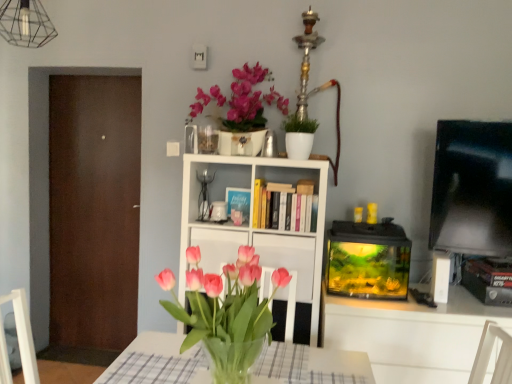
Question: Would you say white glossy mug at center is outside matte ceramic vase at upper center?

Choices:
 (A) yes
 (B) no

Answer: (A)

Question: Can you confirm if white glossy mug at center is shorter than matte ceramic vase at upper center?

Choices:
 (A) yes
 (B) no

Answer: (A)

Question: Is white glossy mug at center to the right of matte ceramic vase at upper center from the viewer's perspective?

Choices:
 (A) yes
 (B) no

Answer: (B)

Question: Does white glossy mug at center have a larger size compared to matte ceramic vase at upper center?

Choices:
 (A) yes
 (B) no

Answer: (B)

Question: Is white glossy mug at center not near matte ceramic vase at upper center?

Choices:
 (A) yes
 (B) no

Answer: (B)

Question: Can you confirm if white glossy mug at center is taller than matte ceramic vase at upper center?

Choices:
 (A) yes
 (B) no

Answer: (B)

Question: Is white glossy cabinet at center closer to the viewer compared to white matte bookcase at center?

Choices:
 (A) yes
 (B) no

Answer: (A)

Question: From the image's perspective, would you say white glossy cabinet at center is positioned over white matte bookcase at center?

Choices:
 (A) no
 (B) yes

Answer: (A)

Question: Is white glossy cabinet at center bigger than white matte bookcase at center?

Choices:
 (A) no
 (B) yes

Answer: (A)

Question: From the image's perspective, would you say white glossy cabinet at center is shown under white matte bookcase at center?

Choices:
 (A) no
 (B) yes

Answer: (B)

Question: Is white glossy cabinet at center located outside white matte bookcase at center?

Choices:
 (A) no
 (B) yes

Answer: (A)

Question: Does white glossy cabinet at center turn towards white matte bookcase at center?

Choices:
 (A) no
 (B) yes

Answer: (B)

Question: From the image's perspective, is brown matte door at left over white glossy cabinet at center?

Choices:
 (A) no
 (B) yes

Answer: (B)